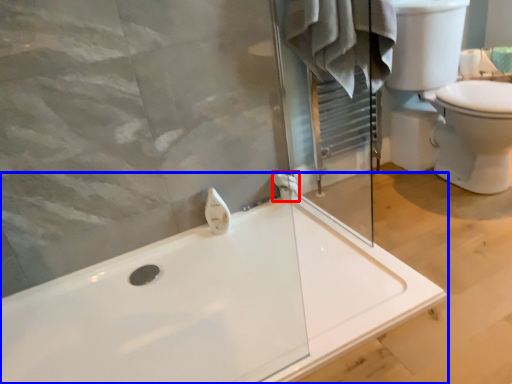
Question: Which object is closer to the camera taking this photo, towel bar (highlighted by a red box) or bathtub (highlighted by a blue box)?

Choices:
 (A) towel bar
 (B) bathtub

Answer: (B)